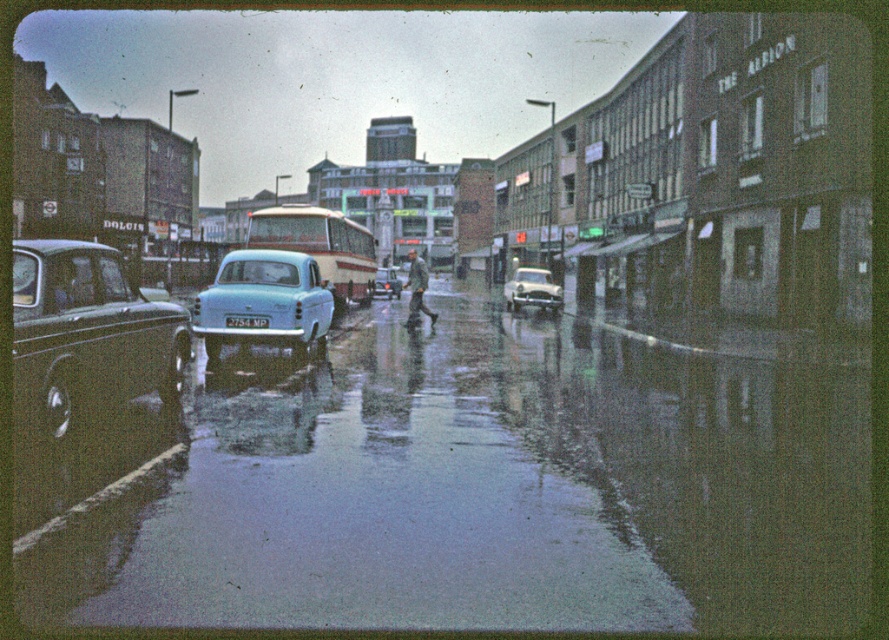
You are a pedestrian who needs to cross the street between the shiny black sedan at left and the light blue glossy sedan at center. The safe distance required to cross is 6 meters. Can you safely cross between them?

The shiny black sedan at left is 7.13 meters away from the light blue glossy sedan at center, which is more than the required 6 meters, so yes, you can safely cross between them.

You are a delivery person trying to navigate through the flooded street. You see the shiny black sedan at left and the light blue glossy sedan at center. Which car is positioned lower in the image?

The shiny black sedan at left is positioned lower in the image than the light blue glossy sedan at center, as it is below it.

Looking at this image, you are standing at the center of the wet urban street scene. There are two points marked in the image, one at point coordinates point (214,324) and the other at point coordinates point (523,269). Which point is nearer to your current position?

Point (214,324) is closer to the camera than point (523,269), so the point at coordinates point (214,324) is nearer to your current position.